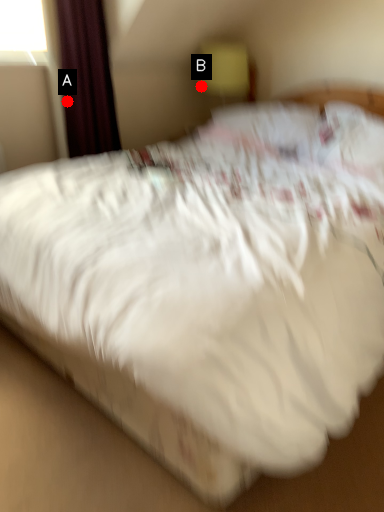
Question: Two points are circled on the image, labeled by A and B beside each circle. Among these points, which one is farthest from the camera?

Choices:
 (A) A is further
 (B) B is further

Answer: (B)